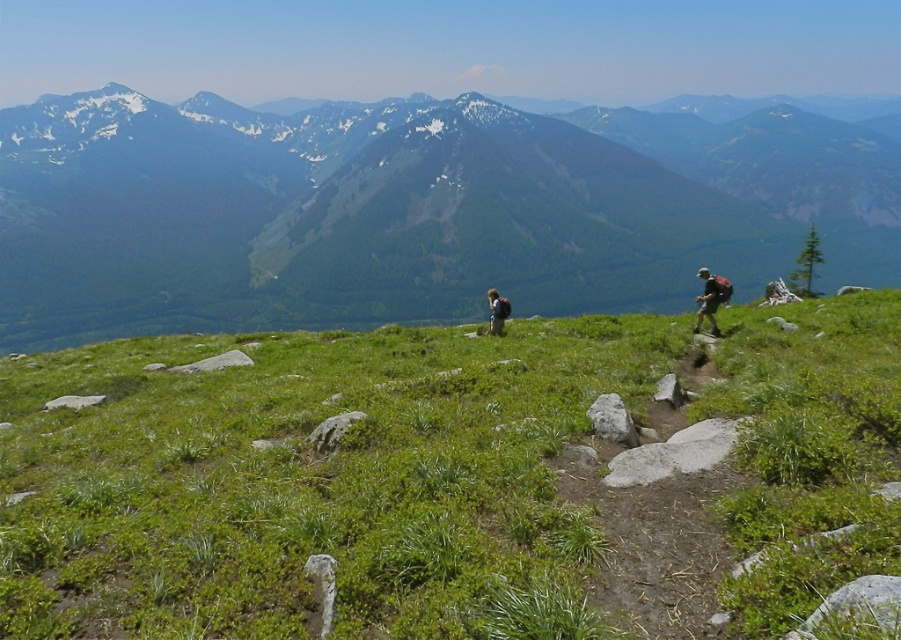
Question: Can you confirm if green grassy at center is bigger than green grassy hillside at center?

Choices:
 (A) no
 (B) yes

Answer: (A)

Question: Does green grassy hillside at center appear under dark gray backpack at right?

Choices:
 (A) yes
 (B) no

Answer: (B)

Question: Which object is positioned farthest from the green grassy at center?

Choices:
 (A) green grassy hillside at center
 (B) green fabric backpack at center

Answer: (A)

Question: Which of the following is the closest to the observer?

Choices:
 (A) 17,586
 (B) 499,316

Answer: (A)

Question: Which object is positioned farthest from the green grassy hillside at center?

Choices:
 (A) dark gray backpack at right
 (B) green grassy at center
 (C) green fabric backpack at center

Answer: (A)

Question: Observing the image, what is the correct spatial positioning of green grassy hillside at center in reference to dark gray backpack at right?

Choices:
 (A) below
 (B) above

Answer: (B)